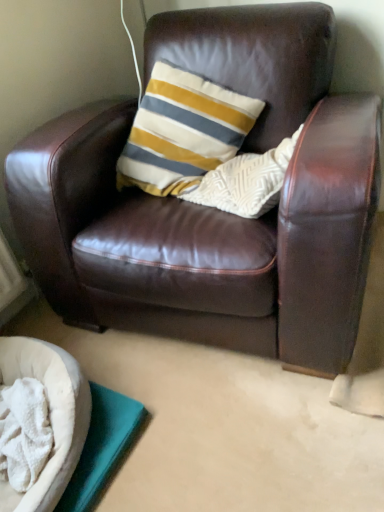
Question: From a real-world perspective, is brown leather chair at center above or below white soft dog bed at lower left?

Choices:
 (A) below
 (B) above

Answer: (B)

Question: Looking at the image, does brown leather chair at center seem bigger or smaller compared to white soft dog bed at lower left?

Choices:
 (A) small
 (B) big

Answer: (B)

Question: From the image's perspective, is brown leather chair at center located above or below white soft dog bed at lower left?

Choices:
 (A) below
 (B) above

Answer: (B)

Question: Is white soft dog bed at lower left spatially inside brown leather chair at center, or outside of it?

Choices:
 (A) inside
 (B) outside

Answer: (B)

Question: In the image, is white soft dog bed at lower left positioned in front of or behind brown leather chair at center?

Choices:
 (A) behind
 (B) front

Answer: (A)

Question: From a real-world perspective, is white soft dog bed at lower left positioned above or below brown leather chair at center?

Choices:
 (A) below
 (B) above

Answer: (A)

Question: In terms of height, does white soft dog bed at lower left look taller or shorter compared to brown leather chair at center?

Choices:
 (A) tall
 (B) short

Answer: (B)